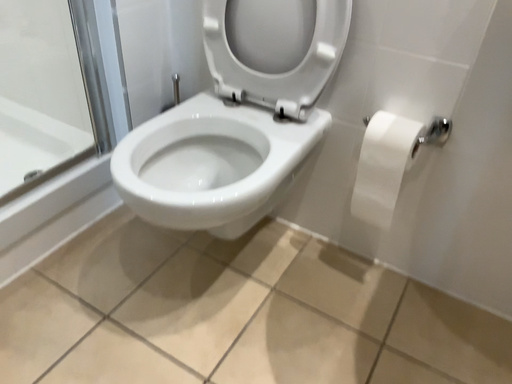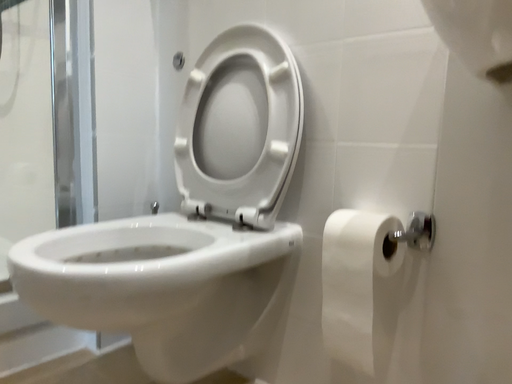
Question: Which way did the camera rotate in the video?

Choices:
 (A) rotated downward
 (B) rotated upward

Answer: (B)